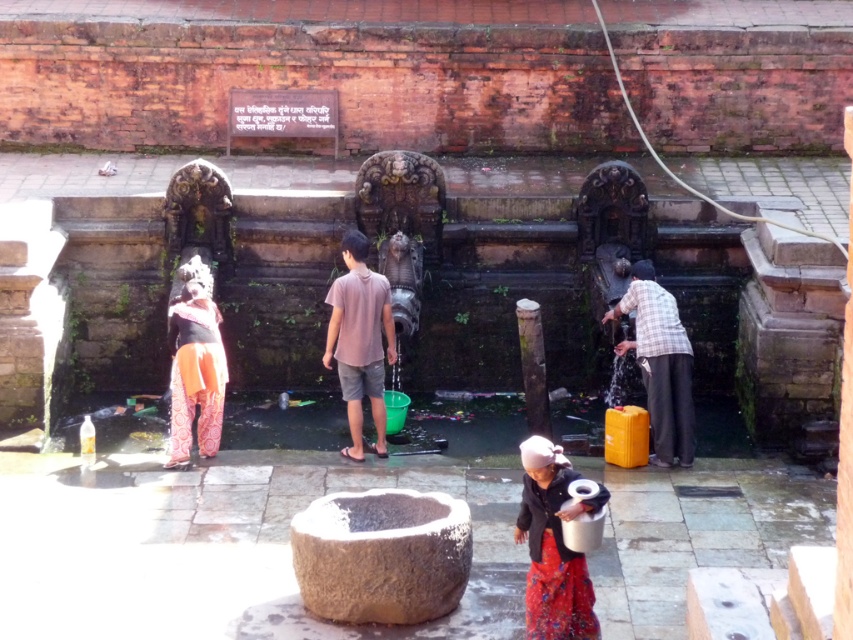
You are a photographer capturing the scene at the temple water source. You notice the red fabric skirt at lower center and the orange printed pants at center. Which clothing item is positioned lower in the image?

The red fabric skirt at lower center is located below the orange printed pants at center, so it is positioned lower in the image.

You are a photographer trying to capture the traditional attire of the person in the scene. The red fabric skirt at lower center and orange printed pants at center are both visible in your frame. Which part of the attire is narrower in width?

The red fabric skirt at lower center has a lesser width compared to orange printed pants at center, so the red fabric skirt at lower center is narrower.